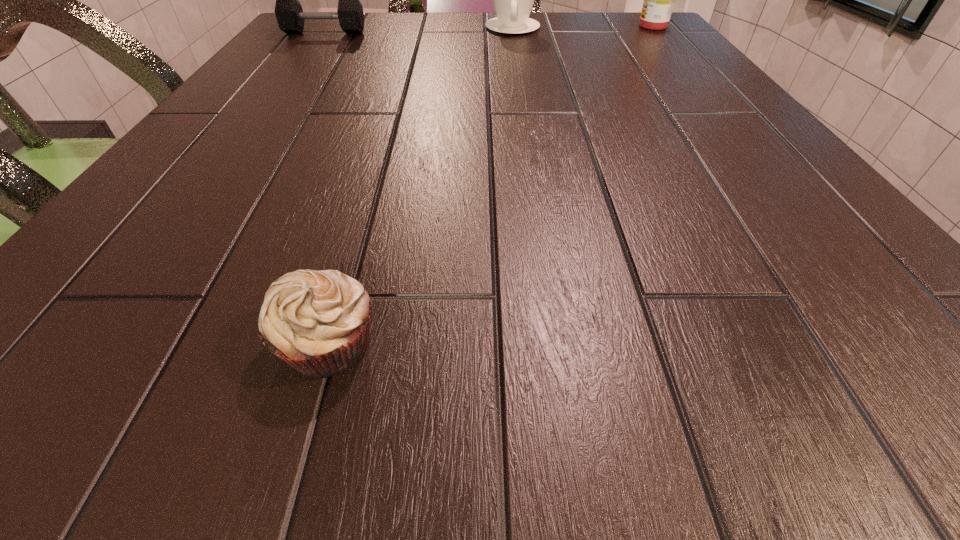
Where is `the tallest object`? the tallest object is located at coordinates (x=659, y=0).

You are a GUI agent. You are given a task and a screenshot of the screen. Output one action in this format:
    pyautogui.click(x=<x>, y=<y>)
    Task: Click on the rightmost object
    
    Given the screenshot: What is the action you would take?
    pyautogui.click(x=659, y=0)

Locate an element on the screen. Image resolution: width=960 pixels, height=540 pixels. cappuccino is located at coordinates (513, 0).

Locate an element on the screen. This screenshot has width=960, height=540. dumbbell is located at coordinates (290, 17).

I want to click on the second object from left to right, so click(318, 322).

Image resolution: width=960 pixels, height=540 pixels. I want to click on muffin, so click(318, 322).

You are a GUI agent. You are given a task and a screenshot of the screen. Output one action in this format:
    pyautogui.click(x=<x>, y=<y>)
    Task: Click on the vacant area located on the label of the rightmost object
    Image resolution: width=960 pixels, height=540 pixels.
    Given the screenshot: What is the action you would take?
    pyautogui.click(x=568, y=26)

What are the coordinates of `free space located on the label of the rightmost object` in the screenshot? It's located at (581, 26).

Find the location of a particular element. Image resolution: width=960 pixels, height=540 pixels. vacant space located on the label of the rightmost object is located at coordinates (564, 26).

You are a GUI agent. You are given a task and a screenshot of the screen. Output one action in this format:
    pyautogui.click(x=<x>, y=<y>)
    Task: Click on the vacant space located 0.120m to the right of the cappuccino's handle
    The height and width of the screenshot is (540, 960).
    Given the screenshot: What is the action you would take?
    pyautogui.click(x=517, y=57)